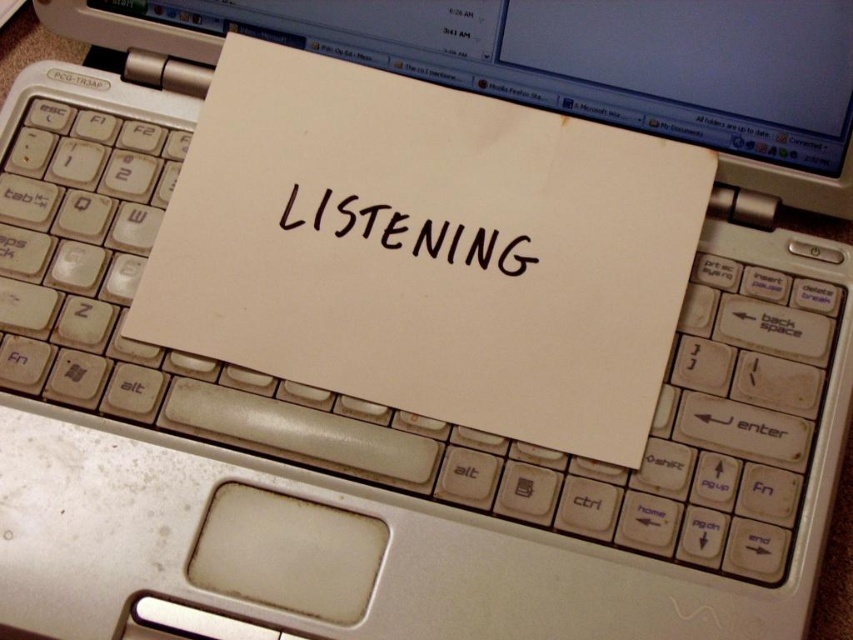
Question: Which of the following is the farthest from the observer?

Choices:
 (A) (276, 352)
 (B) (352, 205)

Answer: (B)

Question: Is white paper at center smaller than black handwritten text at center?

Choices:
 (A) yes
 (B) no

Answer: (B)

Question: Which of the following is the farthest from the observer?

Choices:
 (A) white paper at center
 (B) black handwritten text at center

Answer: (B)

Question: Is white paper at center bigger than black handwritten text at center?

Choices:
 (A) yes
 (B) no

Answer: (A)

Question: Does white paper at center have a greater width compared to black handwritten text at center?

Choices:
 (A) no
 (B) yes

Answer: (B)

Question: Which of the following is the closest to the observer?

Choices:
 (A) white paper at center
 (B) black handwritten text at center

Answer: (A)